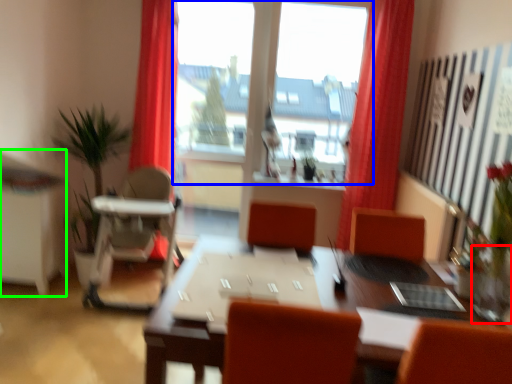
Question: Which object is the closest to the glass vase (highlighted by a red box)? Choose among these: window (highlighted by a blue box) or computer desk (highlighted by a green box).

Choices:
 (A) window
 (B) computer desk

Answer: (B)